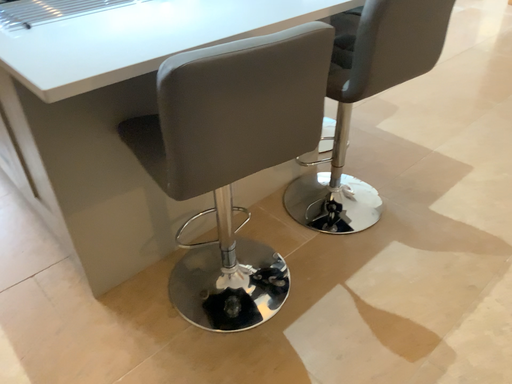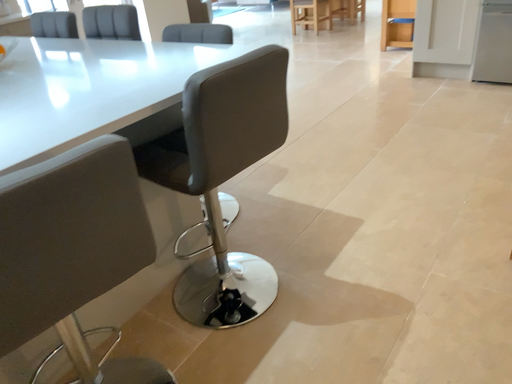
Question: How did the camera likely rotate when shooting the video?

Choices:
 (A) rotated downward
 (B) rotated upward

Answer: (B)